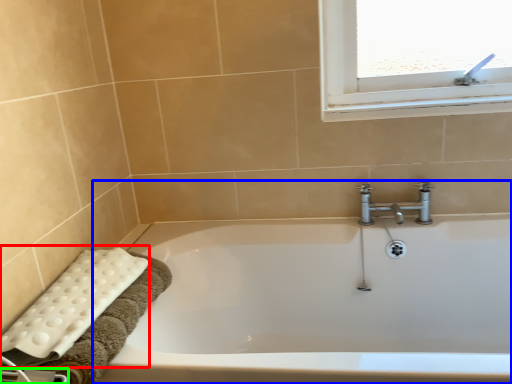
Question: Based on their relative distances, which object is farther from bath towel (highlighted by a red box)? Choose from bathtub (highlighted by a blue box) and towel bar (highlighted by a green box).

Choices:
 (A) bathtub
 (B) towel bar

Answer: (A)